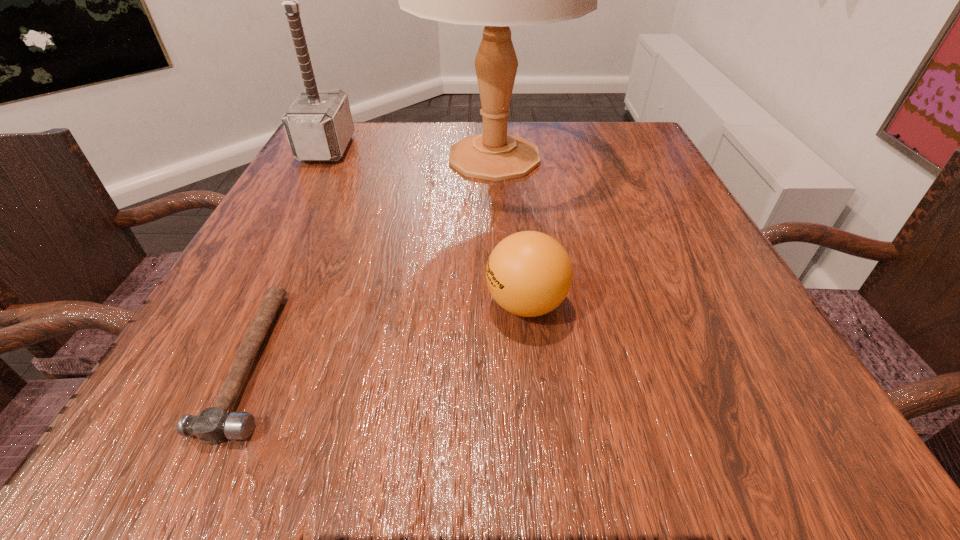
Locate an element on the screen. The image size is (960, 540). vacant region located 0.070m on the side with brand of the third tallest object is located at coordinates (438, 303).

Where is `vacant space situated 0.310m on the striking face of the nearer hammer`? Image resolution: width=960 pixels, height=540 pixels. vacant space situated 0.310m on the striking face of the nearer hammer is located at coordinates (521, 361).

What are the coordinates of `table lamp situated at the far edge` in the screenshot? It's located at (496, 0).

The height and width of the screenshot is (540, 960). Find the location of `hammer positioned at the far edge`. hammer positioned at the far edge is located at coordinates (319, 125).

This screenshot has width=960, height=540. What are the coordinates of `object present at the near edge` in the screenshot? It's located at (212, 425).

This screenshot has height=540, width=960. What are the coordinates of `object that is at the far left corner` in the screenshot? It's located at (319, 125).

This screenshot has height=540, width=960. I want to click on object located in the near left corner section of the desktop, so point(212,425).

Where is `vacant space at the far edge of the desktop`? Image resolution: width=960 pixels, height=540 pixels. vacant space at the far edge of the desktop is located at coordinates (576, 140).

Image resolution: width=960 pixels, height=540 pixels. I want to click on vacant space at the near edge of the desktop, so click(x=319, y=422).

Where is `vacant region at the left edge of the desktop`? The height and width of the screenshot is (540, 960). vacant region at the left edge of the desktop is located at coordinates (318, 307).